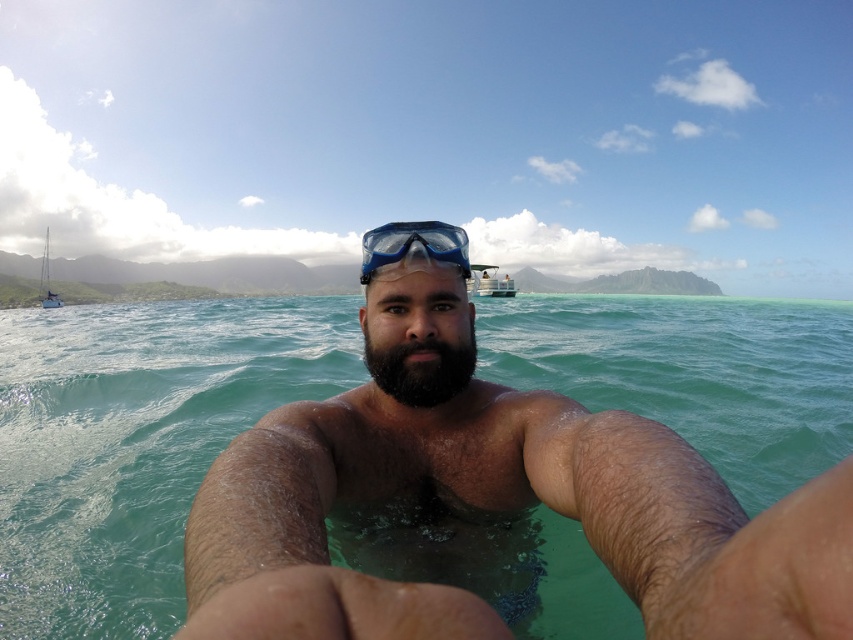
Question: Does blue matte snorkel mask at center appear on the left side of white plastic sailboat at left?

Choices:
 (A) no
 (B) yes

Answer: (A)

Question: Does blue matte snorkel mask at center come behind white plastic sailboat at left?

Choices:
 (A) no
 (B) yes

Answer: (A)

Question: Which point appears farthest from the camera in this image?

Choices:
 (A) (508, 296)
 (B) (44, 273)

Answer: (B)

Question: Which of the following is the farthest from the observer?

Choices:
 (A) (509, 289)
 (B) (402, 355)
 (C) (57, 294)
 (D) (624, 308)

Answer: (C)

Question: Estimate the real-world distances between objects in this image. Which object is farther from the clear water at center?

Choices:
 (A) white plastic boat at upper center
 (B) white plastic sailboat at left
 (C) blue matte snorkel mask at center
 (D) dark brown fuzzy beard at center

Answer: (B)

Question: Can you confirm if clear water at center is positioned below blue matte snorkel mask at center?

Choices:
 (A) no
 (B) yes

Answer: (B)